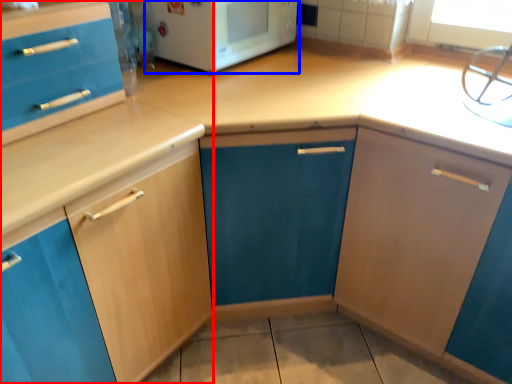
Question: Which point is closer to the camera, cabinetry (highlighted by a red box) or home appliance (highlighted by a blue box)?

Choices:
 (A) cabinetry
 (B) home appliance

Answer: (A)